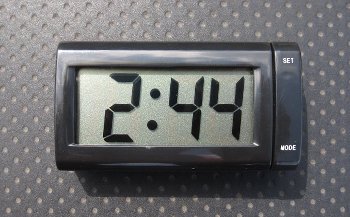
Where is `black frame`? This screenshot has height=217, width=350. black frame is located at coordinates (174, 52).